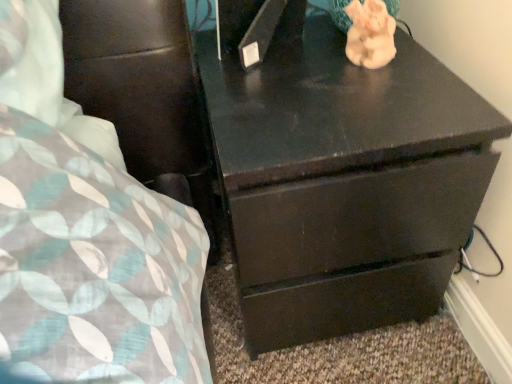
Locate an element on the screen. free space in front of porcelain pink elephant at upper right is located at coordinates (379, 115).